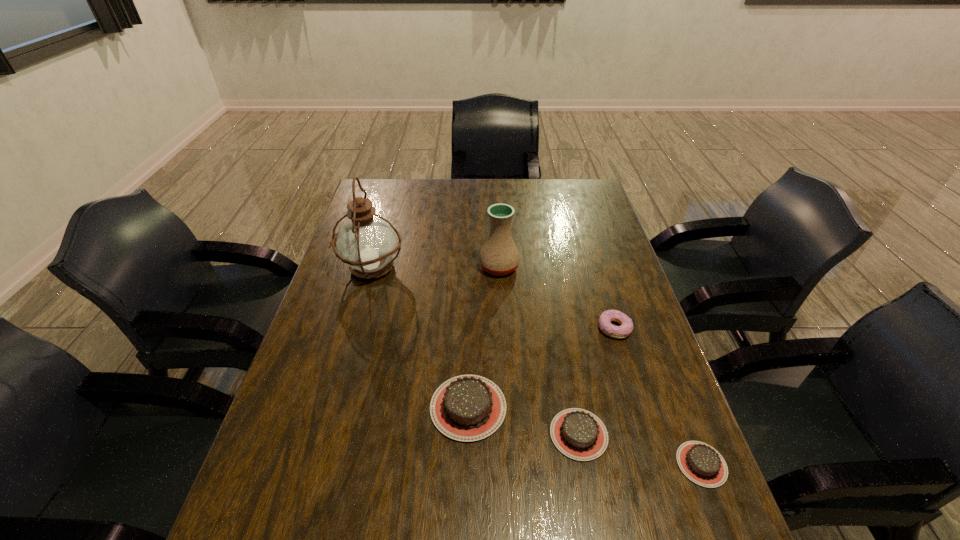
Where is `the tallest chocolate cake`? This screenshot has height=540, width=960. the tallest chocolate cake is located at coordinates (466, 408).

Find the location of `the fourth shortest object`. the fourth shortest object is located at coordinates (466, 408).

The width and height of the screenshot is (960, 540). I want to click on the second chocolate cake from left to right, so coord(577,433).

Locate an element on the screen. the second shortest chocolate cake is located at coordinates (577, 433).

Locate an element on the screen. the rightmost chocolate cake is located at coordinates (702, 464).

Locate an element on the screen. the shortest object is located at coordinates (702, 464).

Locate an element on the screen. This screenshot has height=540, width=960. the leftmost object is located at coordinates (367, 243).

Identify the location of the tallest object. The image size is (960, 540). (367, 243).

Locate an element on the screen. The height and width of the screenshot is (540, 960). pottery is located at coordinates (499, 255).

You are a GUI agent. You are given a task and a screenshot of the screen. Output one action in this format:
    pyautogui.click(x=<x>, y=<y>)
    Task: Click on the fourth nearest object
    This screenshot has width=960, height=540.
    Given the screenshot: What is the action you would take?
    pyautogui.click(x=619, y=332)